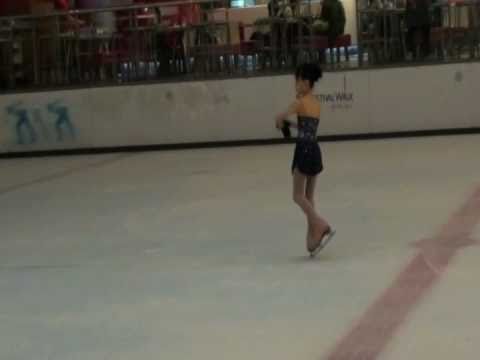
Find the location of `wall`. wall is located at coordinates (391, 109), (18, 128).